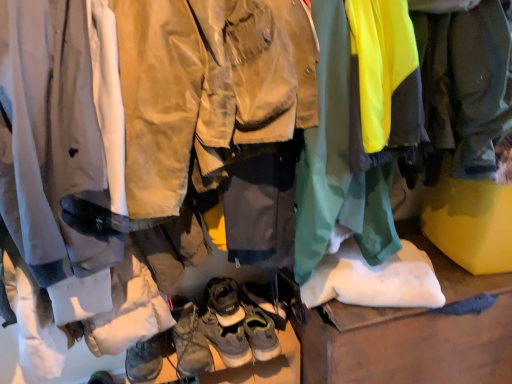
Image resolution: width=512 pixels, height=384 pixels. Describe the element at coordinates (189, 339) in the screenshot. I see `leather brown hiking boots at center, which is the fourth footwear in top-to-bottom order` at that location.

The image size is (512, 384). What do you see at coordinates (226, 322) in the screenshot? I see `leather/textured boots at center, which appears as the third footwear when ordered from the bottom` at bounding box center [226, 322].

Image resolution: width=512 pixels, height=384 pixels. What do you see at coordinates (246, 340) in the screenshot?
I see `brown leather boots at center, which ranks as the fifth footwear in top-to-bottom order` at bounding box center [246, 340].

Identify the location of brown leather boots at center, marked as the 1th footwear in a bottom-to-top arrangement. This screenshot has width=512, height=384. (246, 340).

You are a GUI agent. You are given a task and a screenshot of the screen. Output one action in this format:
    pyautogui.click(x=<x>, y=<y>)
    Task: Click on the leather suede hiking boots at center, which ranks as the fourth footwear in bottom-to-top order
    
    Given the screenshot: What is the action you would take?
    pos(277,298)

Is leather brown hiking boots at center, which is the fourth footwear in top-to-bottom order, completely or partially inside leather/textured boot at center, acting as the 5th footwear starting from the bottom?

That's incorrect, leather brown hiking boots at center, which is the fourth footwear in top-to-bottom order, is not inside leather/textured boot at center, acting as the 5th footwear starting from the bottom.

Which is farther from the camera, (209, 284) or (176, 313)?

The point (209, 284) is more distant.

From a real-world perspective, does leather/textured boot at center, acting as the 5th footwear starting from the bottom, sit lower than leather brown hiking boots at center, which is the fourth footwear in top-to-bottom order?

No, from a real-world perspective, leather/textured boot at center, acting as the 5th footwear starting from the bottom, is not below leather brown hiking boots at center, which is the fourth footwear in top-to-bottom order.

Does leather/textured boot at center, acting as the 5th footwear starting from the bottom, appear on the right side of leather brown hiking boots at center, which is the fourth footwear in top-to-bottom order?

Yes.

You are a GUI agent. You are given a task and a screenshot of the screen. Output one action in this format:
    pyautogui.click(x=<x>, y=<y>)
    Task: Click on the footwear that is the 3rd one when counting upward from the brown leather boots at center, marked as the 1th footwear in a bottom-to-top arrangement (from the image's perspective)
    
    Given the screenshot: What is the action you would take?
    pyautogui.click(x=277, y=298)

From the image's perspective, is leather suede hiking boots at center, which ranks as the fourth footwear in bottom-to-top order, positioned above or below brown leather boots at center, which ranks as the fifth footwear in top-to-bottom order?

leather suede hiking boots at center, which ranks as the fourth footwear in bottom-to-top order, is situated higher than brown leather boots at center, which ranks as the fifth footwear in top-to-bottom order, in the image.

Is leather suede hiking boots at center, the 2th footwear from the top, beside brown leather boots at center, marked as the 1th footwear in a bottom-to-top arrangement?

No, leather suede hiking boots at center, the 2th footwear from the top, is not in contact with brown leather boots at center, marked as the 1th footwear in a bottom-to-top arrangement.

Is leather suede hiking boots at center, the 2th footwear from the top, to the left of brown leather boots at center, marked as the 1th footwear in a bottom-to-top arrangement, from the viewer's perspective?

Incorrect, leather suede hiking boots at center, the 2th footwear from the top, is not on the left side of brown leather boots at center, marked as the 1th footwear in a bottom-to-top arrangement.

Could leather/textured boots at center, which appears as the third footwear when ordered from the bottom, be considered to be inside leather suede hiking boots at center, the 2th footwear from the top?

No, leather/textured boots at center, which appears as the third footwear when ordered from the bottom, is not a part of leather suede hiking boots at center, the 2th footwear from the top.

Is point (289, 309) in front of point (230, 352)?

No.

Based on their sizes in the image, would you say leather suede hiking boots at center, the 2th footwear from the top, is bigger or smaller than leather/textured boots at center, which appears as the third footwear when ordered from the bottom?

In the image, leather suede hiking boots at center, the 2th footwear from the top, appears to be smaller than leather/textured boots at center, which appears as the third footwear when ordered from the bottom.

Is leather suede hiking boots at center, which ranks as the fourth footwear in bottom-to-top order, in front of leather/textured boots at center, which appears as the third footwear when ordered from the bottom?

No, the depth of leather suede hiking boots at center, which ranks as the fourth footwear in bottom-to-top order, is greater than that of leather/textured boots at center, which appears as the third footwear when ordered from the bottom.

Considering the sizes of objects leather/textured boot at center, which appears as the first footwear when viewed from the top, and leather suede hiking boots at center, which ranks as the fourth footwear in bottom-to-top order, in the image provided, who is bigger, leather/textured boot at center, which appears as the first footwear when viewed from the top, or leather suede hiking boots at center, which ranks as the fourth footwear in bottom-to-top order,?

With larger size is leather/textured boot at center, which appears as the first footwear when viewed from the top.

Find the location of a particular element. The width and height of the screenshot is (512, 384). footwear that is the 2nd object located behind the leather/textured boot at center, which appears as the first footwear when viewed from the top is located at coordinates (277, 298).

Based on their positions, is leather/textured boot at center, acting as the 5th footwear starting from the bottom, located to the left or right of leather suede hiking boots at center, which ranks as the fourth footwear in bottom-to-top order?

In the image, leather/textured boot at center, acting as the 5th footwear starting from the bottom, appears on the left side of leather suede hiking boots at center, which ranks as the fourth footwear in bottom-to-top order.

Is leather/textured boot at center, acting as the 5th footwear starting from the bottom, not within leather suede hiking boots at center, the 2th footwear from the top?

That's correct, leather/textured boot at center, acting as the 5th footwear starting from the bottom, is outside of leather suede hiking boots at center, the 2th footwear from the top.

Identify the location of footwear that is the 2nd one when counting backward from the leather brown hiking boots at center, which is the fourth footwear in top-to-bottom order. The width and height of the screenshot is (512, 384). (224, 301).

Would you consider leather brown hiking boots at center, the 2th footwear from the bottom, to be distant from leather/textured boot at center, acting as the 5th footwear starting from the bottom?

No, leather brown hiking boots at center, the 2th footwear from the bottom, is not far from leather/textured boot at center, acting as the 5th footwear starting from the bottom.

Is leather brown hiking boots at center, which is the fourth footwear in top-to-bottom order, thinner than leather/textured boot at center, acting as the 5th footwear starting from the bottom?

No.

Between leather brown hiking boots at center, which is the fourth footwear in top-to-bottom order, and leather/textured boot at center, acting as the 5th footwear starting from the bottom, which one appears on the right side from the viewer's perspective?

leather/textured boot at center, acting as the 5th footwear starting from the bottom, is more to the right.

Is leather/textured boot at center, acting as the 5th footwear starting from the bottom, oriented away from brown leather boots at center, which ranks as the fifth footwear in top-to-bottom order?

No, leather/textured boot at center, acting as the 5th footwear starting from the bottom,'s orientation is not away from brown leather boots at center, which ranks as the fifth footwear in top-to-bottom order.

Is leather/textured boot at center, which appears as the first footwear when viewed from the top, further to the viewer compared to brown leather boots at center, which ranks as the fifth footwear in top-to-bottom order?

No, leather/textured boot at center, which appears as the first footwear when viewed from the top, is in front of brown leather boots at center, which ranks as the fifth footwear in top-to-bottom order.

Between leather/textured boot at center, acting as the 5th footwear starting from the bottom, and brown leather boots at center, marked as the 1th footwear in a bottom-to-top arrangement, which one has smaller size?

leather/textured boot at center, acting as the 5th footwear starting from the bottom.

Could you measure the distance between leather/textured boot at center, acting as the 5th footwear starting from the bottom, and brown leather boots at center, marked as the 1th footwear in a bottom-to-top arrangement?

A distance of 12.01 centimeters exists between leather/textured boot at center, acting as the 5th footwear starting from the bottom, and brown leather boots at center, marked as the 1th footwear in a bottom-to-top arrangement.

Does leather/textured boot at center, which appears as the first footwear when viewed from the top, have a lesser width compared to leather/textured boots at center, which appears as the third footwear when ordered from the bottom?

Yes, leather/textured boot at center, which appears as the first footwear when viewed from the top, is thinner than leather/textured boots at center, which appears as the third footwear when ordered from the bottom.

Can you confirm if leather/textured boot at center, which appears as the first footwear when viewed from the top, is positioned to the right of leather/textured boots at center, acting as the 3th footwear starting from the top?

In fact, leather/textured boot at center, which appears as the first footwear when viewed from the top, is to the left of leather/textured boots at center, acting as the 3th footwear starting from the top.

Is point (221, 321) closer or farther from the camera than point (241, 331)?

Point (221, 321) appears to be closer to the viewer than point (241, 331).

Is leather/textured boot at center, acting as the 5th footwear starting from the bottom, oriented away from leather/textured boots at center, which appears as the third footwear when ordered from the bottom?

That's not correct — leather/textured boot at center, acting as the 5th footwear starting from the bottom, is not looking away from leather/textured boots at center, which appears as the third footwear when ordered from the bottom.

Which footwear is the 2nd one when counting from the right side of the leather brown hiking boots at center, the 2th footwear from the bottom? Please provide its 2D coordinates.

[(224, 301)]

Where is `the 1st footwear in front of the leather suede hiking boots at center, the 2th footwear from the top, counting from the anchor's position`? The width and height of the screenshot is (512, 384). the 1st footwear in front of the leather suede hiking boots at center, the 2th footwear from the top, counting from the anchor's position is located at coordinates (246, 340).

Which object lies further to the anchor point leather/textured boots at center, acting as the 3th footwear starting from the top, leather/textured boot at center, which appears as the first footwear when viewed from the top, or leather brown hiking boots at center, which is the fourth footwear in top-to-bottom order?

The object further to leather/textured boots at center, acting as the 3th footwear starting from the top, is leather brown hiking boots at center, which is the fourth footwear in top-to-bottom order.

Which object lies nearer to the anchor point leather/textured boot at center, which appears as the first footwear when viewed from the top, leather/textured boots at center, acting as the 3th footwear starting from the top, or brown leather boots at center, which ranks as the fifth footwear in top-to-bottom order?

leather/textured boots at center, acting as the 3th footwear starting from the top, is positioned closer to the anchor leather/textured boot at center, which appears as the first footwear when viewed from the top.

From the image, which object appears to be farther from leather/textured boot at center, which appears as the first footwear when viewed from the top, leather brown hiking boots at center, the 2th footwear from the bottom, or leather/textured boots at center, acting as the 3th footwear starting from the top?

Among the two, leather brown hiking boots at center, the 2th footwear from the bottom, is located further to leather/textured boot at center, which appears as the first footwear when viewed from the top.

Considering their positions, is leather brown hiking boots at center, which is the fourth footwear in top-to-bottom order, positioned closer to leather suede hiking boots at center, which ranks as the fourth footwear in bottom-to-top order, than leather/textured boots at center, which appears as the third footwear when ordered from the bottom?

leather/textured boots at center, which appears as the third footwear when ordered from the bottom, is positioned closer to the anchor leather suede hiking boots at center, which ranks as the fourth footwear in bottom-to-top order.

When comparing their distances from leather/textured boots at center, acting as the 3th footwear starting from the top, does leather brown hiking boots at center, the 2th footwear from the bottom, or leather/textured boot at center, acting as the 5th footwear starting from the bottom, seem further?

Based on the image, leather brown hiking boots at center, the 2th footwear from the bottom, appears to be further to leather/textured boots at center, acting as the 3th footwear starting from the top.

Looking at the image, which one is located closer to leather suede hiking boots at center, which ranks as the fourth footwear in bottom-to-top order, brown leather boots at center, marked as the 1th footwear in a bottom-to-top arrangement, or leather/textured boot at center, acting as the 5th footwear starting from the bottom?

Among the two, leather/textured boot at center, acting as the 5th footwear starting from the bottom, is located nearer to leather suede hiking boots at center, which ranks as the fourth footwear in bottom-to-top order.

From the picture: Based on their spatial positions, is leather suede hiking boots at center, which ranks as the fourth footwear in bottom-to-top order, or brown leather boots at center, which ranks as the fifth footwear in top-to-bottom order, closer to leather/textured boot at center, acting as the 5th footwear starting from the bottom?

The object closer to leather/textured boot at center, acting as the 5th footwear starting from the bottom, is brown leather boots at center, which ranks as the fifth footwear in top-to-bottom order.

Considering their positions, is brown leather boots at center, marked as the 1th footwear in a bottom-to-top arrangement, positioned further to leather/textured boot at center, acting as the 5th footwear starting from the bottom, than leather/textured boots at center, acting as the 3th footwear starting from the top?

brown leather boots at center, marked as the 1th footwear in a bottom-to-top arrangement, is further to leather/textured boot at center, acting as the 5th footwear starting from the bottom.

Identify the location of footwear that lies between leather/textured boots at center, which appears as the third footwear when ordered from the bottom, and brown leather boots at center, which ranks as the fifth footwear in top-to-bottom order, from top to bottom. (189, 339).

The image size is (512, 384). Find the location of `footwear between leather/textured boot at center, which appears as the first footwear when viewed from the top, and leather suede hiking boots at center, which ranks as the fourth footwear in bottom-to-top order, in the horizontal direction`. footwear between leather/textured boot at center, which appears as the first footwear when viewed from the top, and leather suede hiking boots at center, which ranks as the fourth footwear in bottom-to-top order, in the horizontal direction is located at coordinates (226, 322).